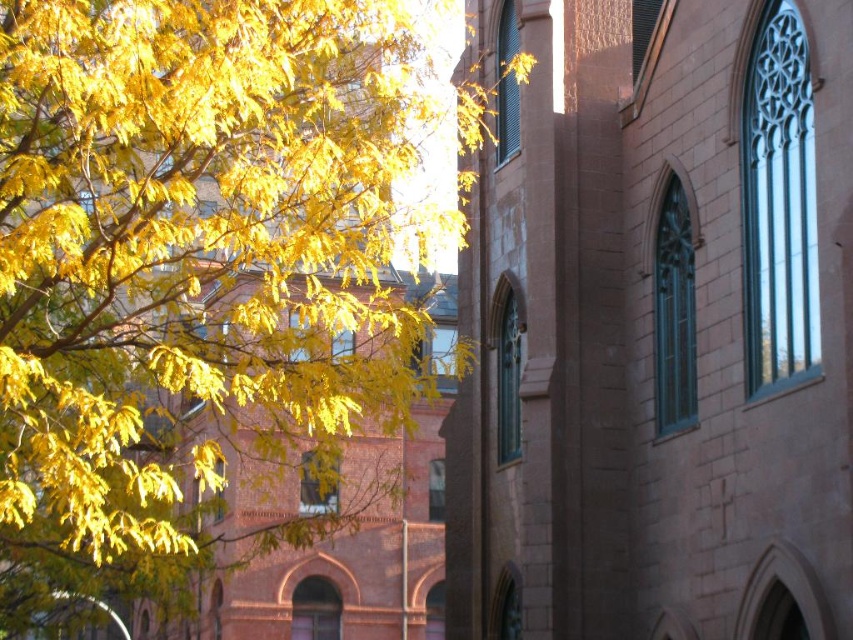
Question: Can you confirm if brown stone tower at center is positioned to the right of yellow leafy branches at left?

Choices:
 (A) yes
 (B) no

Answer: (A)

Question: From the image, what is the correct spatial relationship of brown stone tower at center in relation to yellow leafy branches at left?

Choices:
 (A) left
 (B) right

Answer: (B)

Question: Is brown stone tower at center wider than yellow leafy branches at left?

Choices:
 (A) no
 (B) yes

Answer: (A)

Question: Among these objects, which one is nearest to the camera?

Choices:
 (A) yellow leafy branches at left
 (B) brown stone tower at center

Answer: (A)